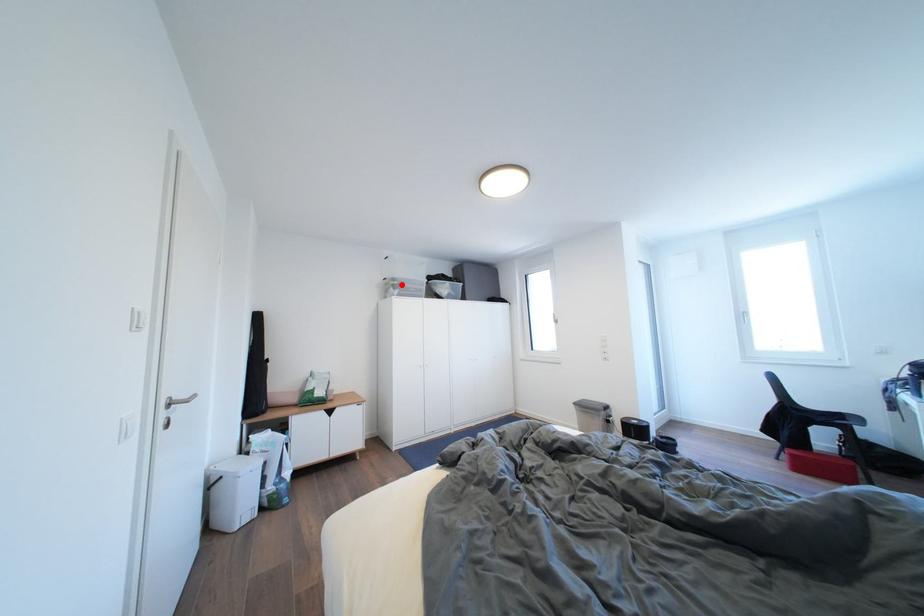
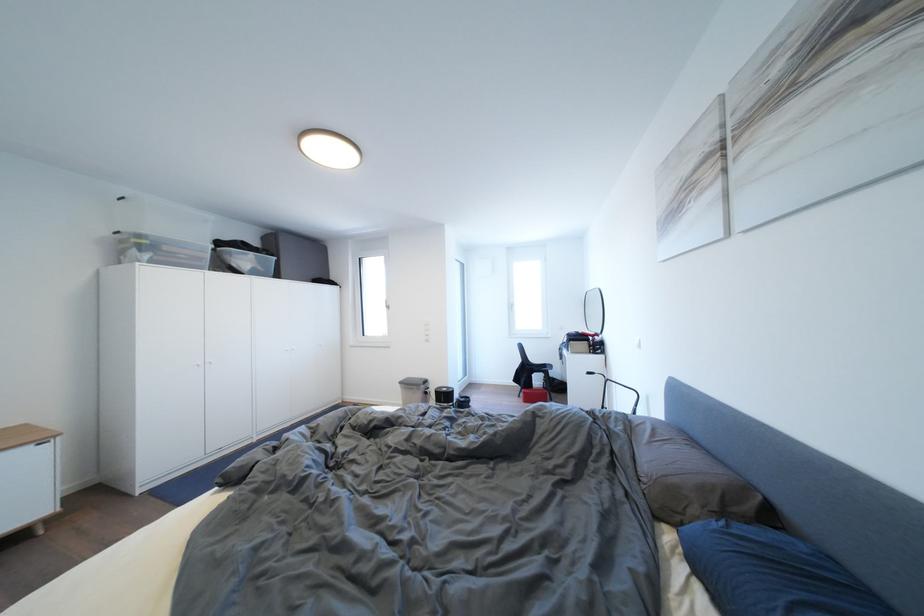
Locate, in the second image, the point that corresponds to the highlighted location in the first image.

(149, 241)